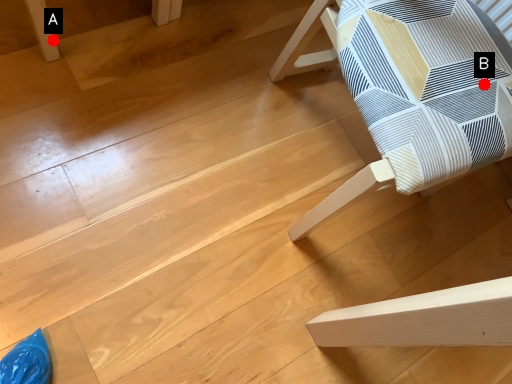
Question: Two points are circled on the image, labeled by A and B beside each circle. Which point is closer to the camera?

Choices:
 (A) A is closer
 (B) B is closer

Answer: (B)